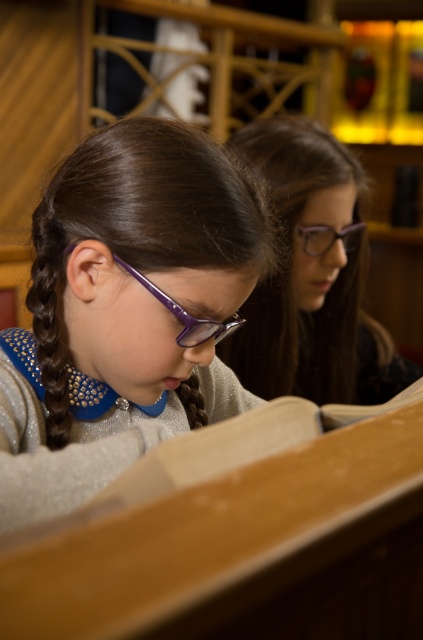
Question: Can you confirm if brown shiny hair braid at left is bigger than purple plastic glasses at upper center?

Choices:
 (A) yes
 (B) no

Answer: (A)

Question: Among these objects, which one is nearest to the camera?

Choices:
 (A) purple glossy glasses at center
 (B) brown shiny hair braid at left
 (C) brown braided hair at center
 (D) purple plastic glasses at upper center

Answer: (A)

Question: Is brown shiny hair braid at left thinner than purple plastic glasses at upper center?

Choices:
 (A) yes
 (B) no

Answer: (B)

Question: Which object is farther from the camera taking this photo?

Choices:
 (A) matte purple glasses at upper center
 (B) purple acetate glasses at center
 (C) purple plastic glasses at upper center

Answer: (C)

Question: Can you confirm if brown shiny hair braid at left is positioned to the left of brown braided hair at center?

Choices:
 (A) no
 (B) yes

Answer: (B)

Question: Which point is farther to the camera?

Choices:
 (A) pyautogui.click(x=21, y=394)
 (B) pyautogui.click(x=65, y=344)

Answer: (B)